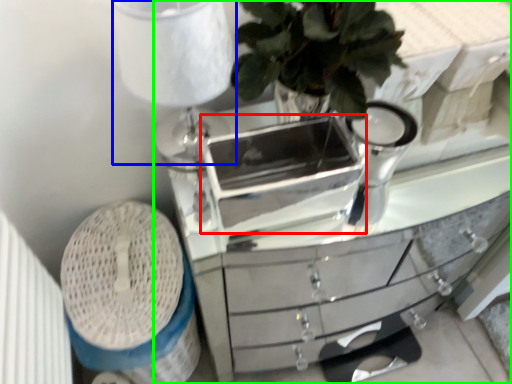
Question: Considering the real-world distances, which object is closest to appliance (highlighted by a red box)? table lamp (highlighted by a blue box) or chest of drawers (highlighted by a green box).

Choices:
 (A) table lamp
 (B) chest of drawers

Answer: (B)